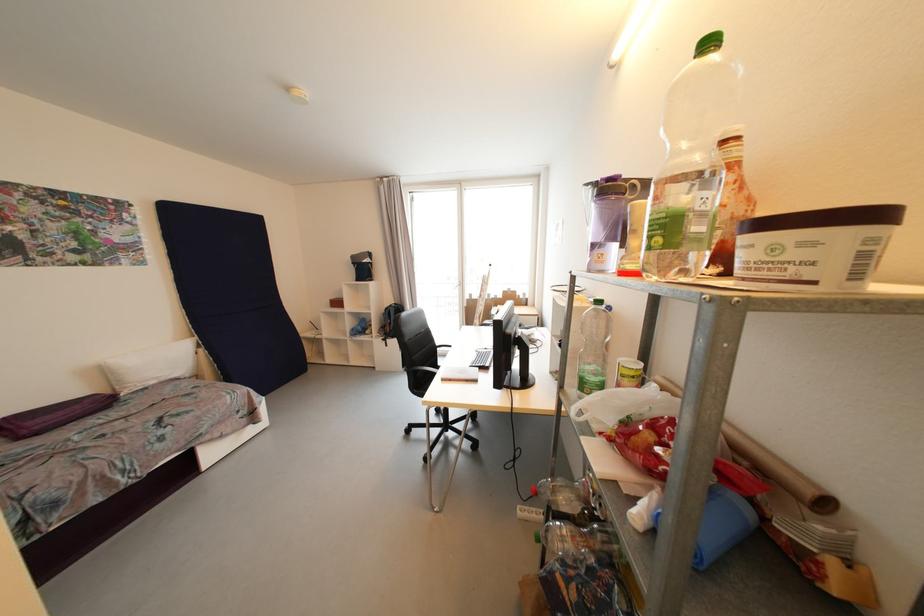
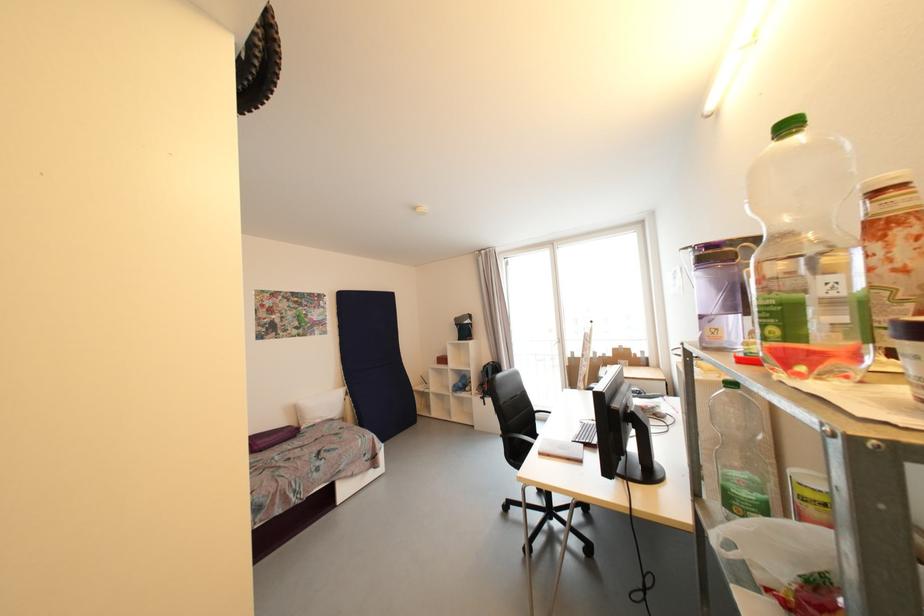
In the second image, find the point that corresponds to [663,241] in the first image.

(780, 331)